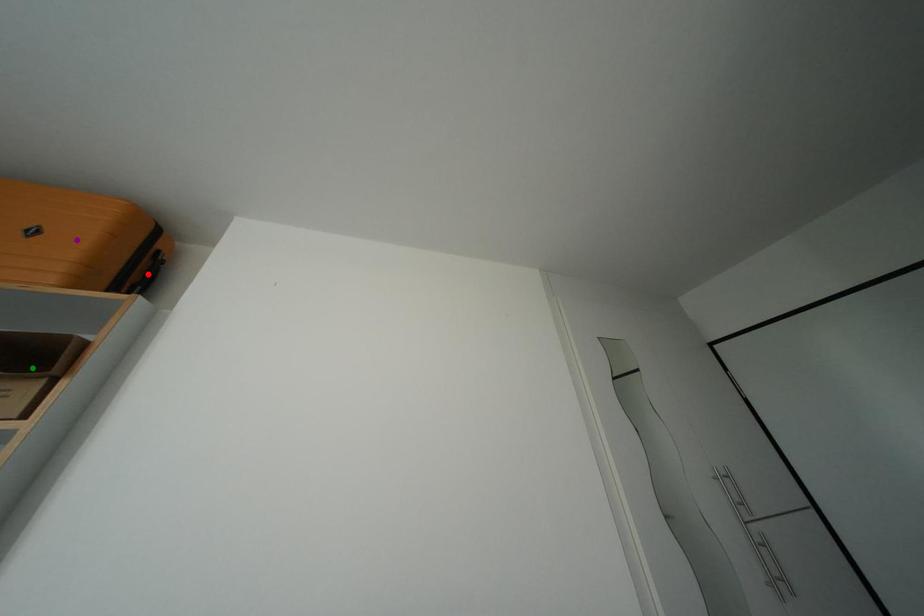
Order these from nearest to farthest:
purple point | green point | red point

red point → purple point → green point